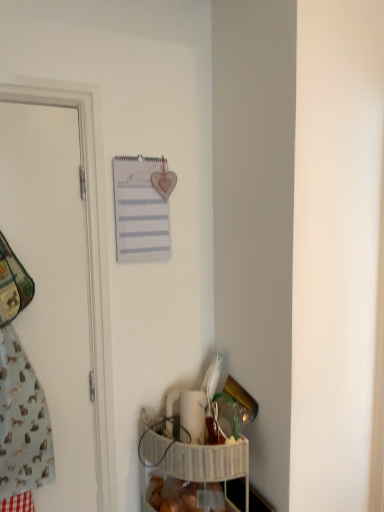
Question: Considering the relative positions of white woven basket at lower right and white matte door at left in the image provided, is white woven basket at lower right to the right of white matte door at left from the viewer's perspective?

Choices:
 (A) no
 (B) yes

Answer: (B)

Question: From the image's perspective, does white woven basket at lower right appear lower than white matte door at left?

Choices:
 (A) no
 (B) yes

Answer: (B)

Question: From the image's perspective, is white woven basket at lower right on top of white matte door at left?

Choices:
 (A) yes
 (B) no

Answer: (B)

Question: Does white woven basket at lower right have a lesser height compared to white matte door at left?

Choices:
 (A) no
 (B) yes

Answer: (B)

Question: Does white woven basket at lower right come in front of white matte door at left?

Choices:
 (A) yes
 (B) no

Answer: (B)

Question: Is white paper journal at upper center taller or shorter than light blue fabric at left?

Choices:
 (A) tall
 (B) short

Answer: (B)

Question: Which is correct: white paper journal at upper center is inside light blue fabric at left, or outside of it?

Choices:
 (A) inside
 (B) outside

Answer: (B)

Question: From the image's perspective, is white paper journal at upper center located above or below light blue fabric at left?

Choices:
 (A) above
 (B) below

Answer: (A)

Question: From a real-world perspective, is white paper journal at upper center above or below light blue fabric at left?

Choices:
 (A) above
 (B) below

Answer: (A)

Question: From the image's perspective, is white woven basket at lower right positioned above or below white matte door at left?

Choices:
 (A) above
 (B) below

Answer: (B)

Question: Relative to white matte door at left, is white woven basket at lower right in front or behind?

Choices:
 (A) front
 (B) behind

Answer: (B)

Question: From a real-world perspective, is white woven basket at lower right above or below white matte door at left?

Choices:
 (A) above
 (B) below

Answer: (B)

Question: Is white woven basket at lower right to the left or to the right of white matte door at left in the image?

Choices:
 (A) left
 (B) right

Answer: (B)

Question: In the image, is translucent plastic bag of bread at lower center positioned in front of or behind white woven basket at lower right?

Choices:
 (A) behind
 (B) front

Answer: (A)

Question: Considering the positions of translucent plastic bag of bread at lower center and white woven basket at lower right in the image, is translucent plastic bag of bread at lower center bigger or smaller than white woven basket at lower right?

Choices:
 (A) big
 (B) small

Answer: (B)